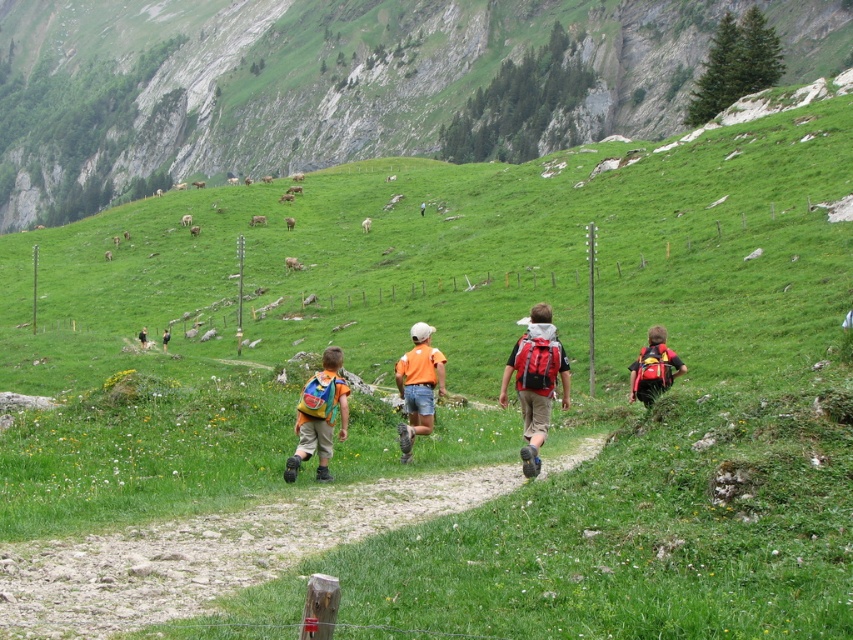
Question: Is orange fabric shorts at center to the left of red backpack at right from the viewer's perspective?

Choices:
 (A) no
 (B) yes

Answer: (B)

Question: Among these points, which one is farthest from the camera?

Choices:
 (A) pos(143,340)
 (B) pos(635,371)

Answer: (A)

Question: Can you confirm if matte yellow backpack at center is positioned above orange fabric shorts at center?

Choices:
 (A) yes
 (B) no

Answer: (B)

Question: Does dirt path at center have a lesser width compared to red backpack at right?

Choices:
 (A) yes
 (B) no

Answer: (B)

Question: Among these points, which one is nearest to the camera?

Choices:
 (A) (54, 102)
 (B) (164, 348)
 (C) (141, 333)

Answer: (C)

Question: Which object appears closest to the camera in this image?

Choices:
 (A) orange backpack at center
 (B) green grassy hillside at upper center
 (C) orange fabric shorts at center
 (D) red backpack at right

Answer: (C)